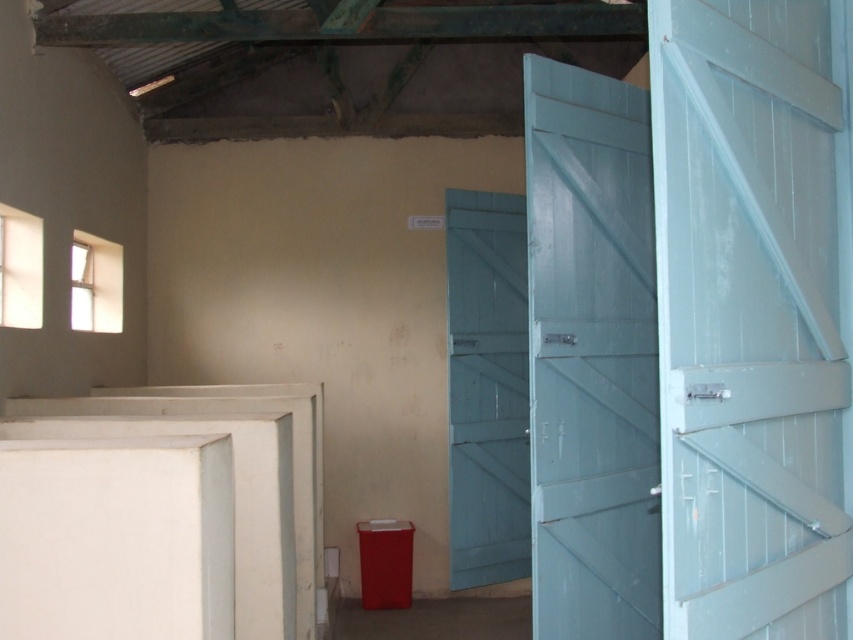
Question: Which point is closer to the camera taking this photo?

Choices:
 (A) (577, 227)
 (B) (792, 77)
 (C) (514, 212)

Answer: (B)

Question: Which of these objects is positioned farthest from the white painted wood door at right?

Choices:
 (A) light blue wooden door at right
 (B) light blue wooden door at center

Answer: (B)

Question: Among these objects, which one is farthest from the camera?

Choices:
 (A) light blue wooden door at center
 (B) white painted wood door at right
 (C) light blue wooden door at right

Answer: (A)

Question: Does white painted wood door at right appear under light blue wooden door at center?

Choices:
 (A) no
 (B) yes

Answer: (A)

Question: From the image, what is the correct spatial relationship of white painted wood door at right in relation to light blue wooden door at center?

Choices:
 (A) left
 (B) right

Answer: (B)

Question: Is white painted wood door at right to the left of light blue wooden door at center from the viewer's perspective?

Choices:
 (A) no
 (B) yes

Answer: (A)